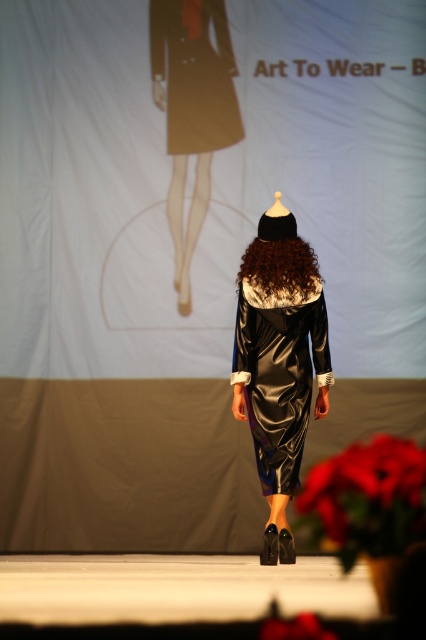
Question: Does satin dress at center have a larger size compared to brown furry wig at center?

Choices:
 (A) no
 (B) yes

Answer: (B)

Question: Does matte brown skirt at upper center have a larger size compared to brown fuzzy coat at upper center?

Choices:
 (A) yes
 (B) no

Answer: (A)

Question: Considering the real-world distances, which object is farthest from the brown fuzzy coat at upper center?

Choices:
 (A) matte brown skirt at upper center
 (B) brown furry wig at center

Answer: (B)

Question: Which of these objects is positioned farthest from the satin dress at center?

Choices:
 (A) matte brown skirt at upper center
 (B) brown fuzzy coat at upper center
 (C) brown furry wig at center

Answer: (B)

Question: Does satin dress at center appear on the left side of brown furry wig at center?

Choices:
 (A) yes
 (B) no

Answer: (B)

Question: Which of the following is the closest to the observer?

Choices:
 (A) matte brown skirt at upper center
 (B) brown furry wig at center

Answer: (B)